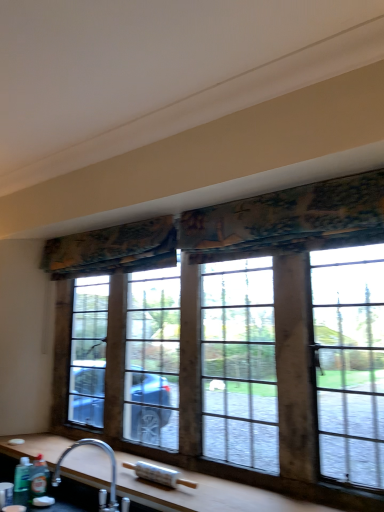
Question: Is wooden at lower center wider than wooden-framed window at center?

Choices:
 (A) no
 (B) yes

Answer: (B)

Question: From a real-world perspective, is wooden at lower center over wooden-framed window at center?

Choices:
 (A) no
 (B) yes

Answer: (A)

Question: Would you say wooden at lower center contains wooden-framed window at center?

Choices:
 (A) yes
 (B) no

Answer: (B)

Question: Considering the relative sizes of wooden at lower center and wooden-framed window at center in the image provided, is wooden at lower center thinner than wooden-framed window at center?

Choices:
 (A) no
 (B) yes

Answer: (A)

Question: Considering the relative positions of wooden at lower center and wooden-framed window at center in the image provided, is wooden at lower center to the left of wooden-framed window at center from the viewer's perspective?

Choices:
 (A) yes
 (B) no

Answer: (A)

Question: In the image, is textured floral fabric at upper center, placed as the second curtain when sorted from left to right, positioned in front of or behind silver metallic faucet at lower left?

Choices:
 (A) front
 (B) behind

Answer: (A)

Question: Considering the positions of textured floral fabric at upper center, placed as the first curtain when sorted from front to back, and silver metallic faucet at lower left in the image, is textured floral fabric at upper center, placed as the first curtain when sorted from front to back, taller or shorter than silver metallic faucet at lower left?

Choices:
 (A) tall
 (B) short

Answer: (B)

Question: Is point pyautogui.click(x=258, y=199) closer or farther from the camera than point pyautogui.click(x=109, y=456)?

Choices:
 (A) closer
 (B) farther

Answer: (A)

Question: Is textured floral fabric at upper center, placed as the second curtain when sorted from left to right, wider or thinner than silver metallic faucet at lower left?

Choices:
 (A) wide
 (B) thin

Answer: (B)

Question: Would you say wooden at lower center is inside or outside textured fabric curtain at upper center, the first curtain when ordered from back to front?

Choices:
 (A) inside
 (B) outside

Answer: (B)

Question: From the image's perspective, is wooden at lower center located above or below textured fabric curtain at upper center, arranged as the first curtain when viewed from the left?

Choices:
 (A) above
 (B) below

Answer: (B)

Question: Considering the positions of wooden at lower center and textured fabric curtain at upper center, the first curtain when ordered from back to front, in the image, is wooden at lower center taller or shorter than textured fabric curtain at upper center, the first curtain when ordered from back to front,?

Choices:
 (A) tall
 (B) short

Answer: (B)

Question: Considering the positions of point (49, 460) and point (148, 231), is point (49, 460) closer or farther from the camera than point (148, 231)?

Choices:
 (A) farther
 (B) closer

Answer: (B)

Question: From a real-world perspective, is translucent plastic bottle at lower left, the first bottle viewed from the left, physically located above or below silver metallic faucet at lower left?

Choices:
 (A) above
 (B) below

Answer: (B)

Question: From their relative heights in the image, would you say translucent plastic bottle at lower left, the first bottle viewed from the left, is taller or shorter than silver metallic faucet at lower left?

Choices:
 (A) tall
 (B) short

Answer: (B)